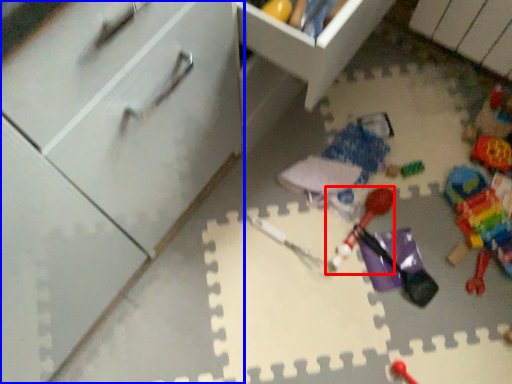
Question: Which object appears closest to the camera in this image, toy (highlighted by a red box) or cabinetry (highlighted by a blue box)?

Choices:
 (A) toy
 (B) cabinetry

Answer: (B)